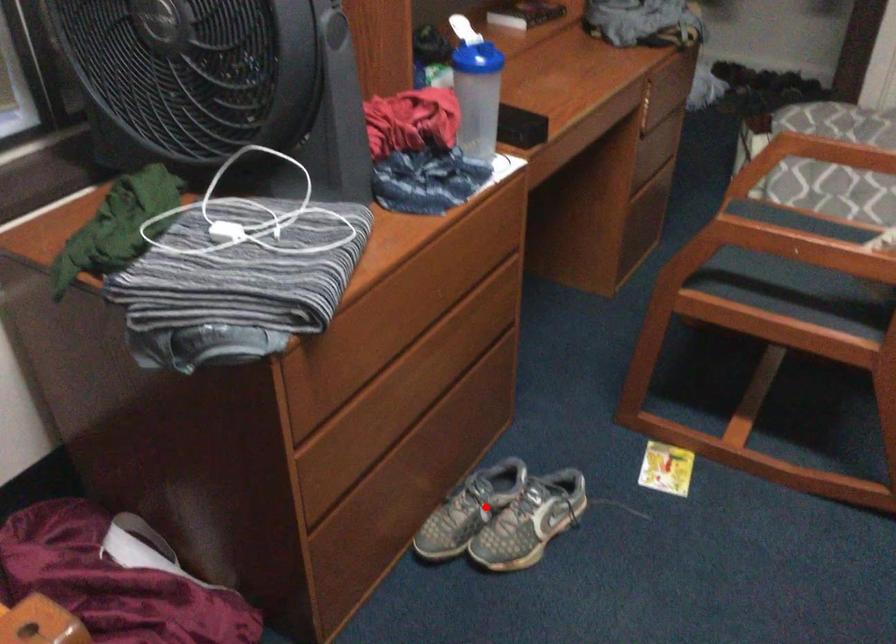
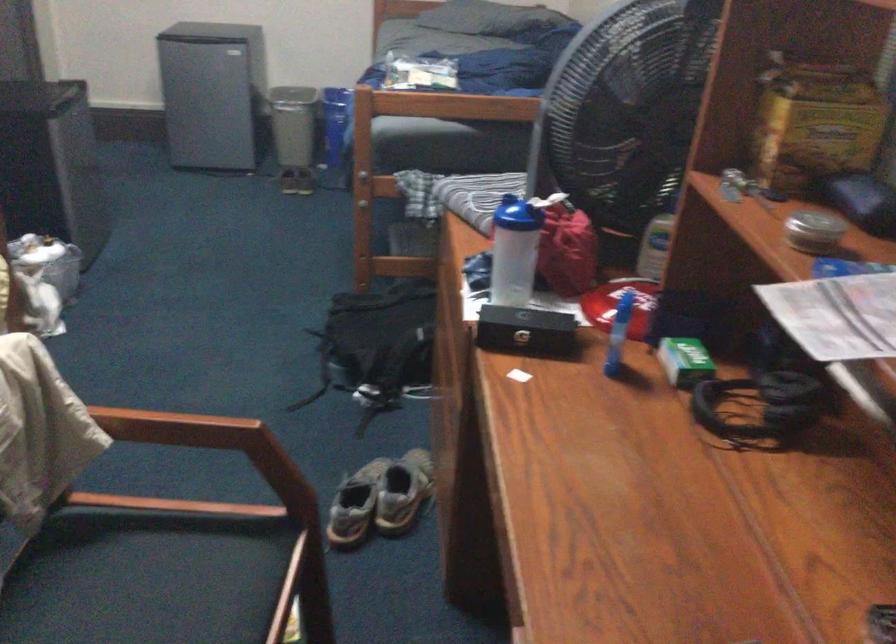
Question: I am providing you with two images of the same scene from different viewpoints. Given a red point in image1, look at the same physical point in image2. Is it:

Choices:
 (A) Closer to the viewpoint
 (B) Farther from the viewpoint

Answer: (B)